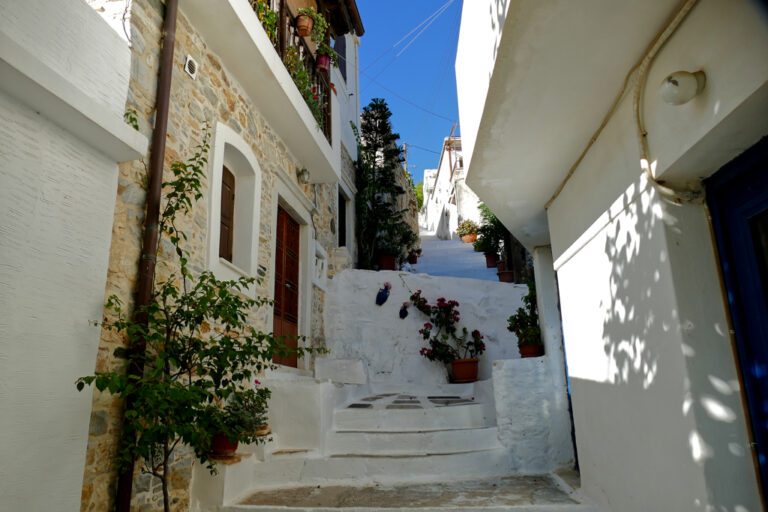
Where is `door`? door is located at coordinates (290, 279).